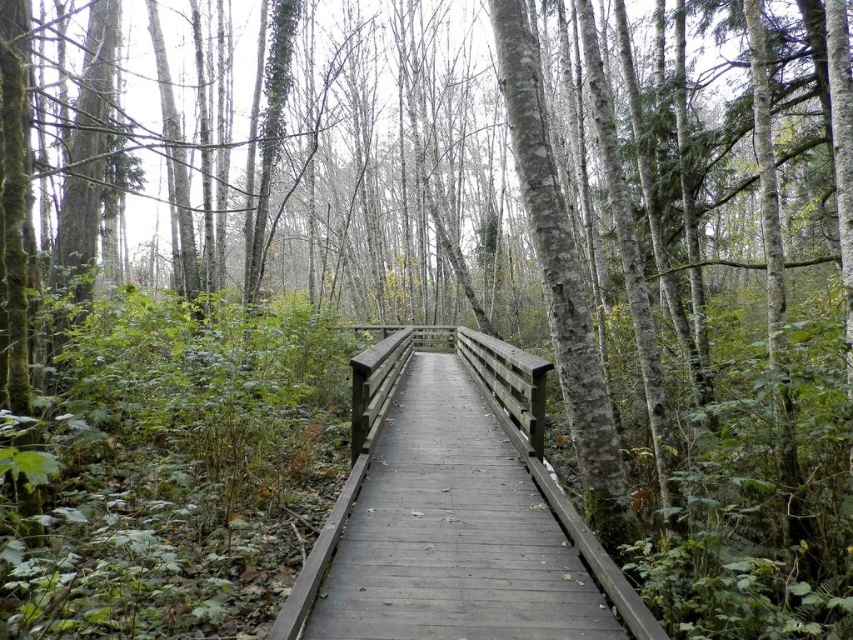
Who is lower down, smooth wooden bridge at center or smooth wooden railing at center?

smooth wooden bridge at center is below.

Is smooth wooden bridge at center wider than smooth wooden railing at center?

Correct, the width of smooth wooden bridge at center exceeds that of smooth wooden railing at center.

Does point (554, 563) come farther from viewer compared to point (358, 412)?

No, it is not.

You are a GUI agent. You are given a task and a screenshot of the screen. Output one action in this format:
    pyautogui.click(x=<x>, y=<y>)
    Task: Click on the smooth wooden bridge at center
    
    Given the screenshot: What is the action you would take?
    pyautogui.click(x=453, y=532)